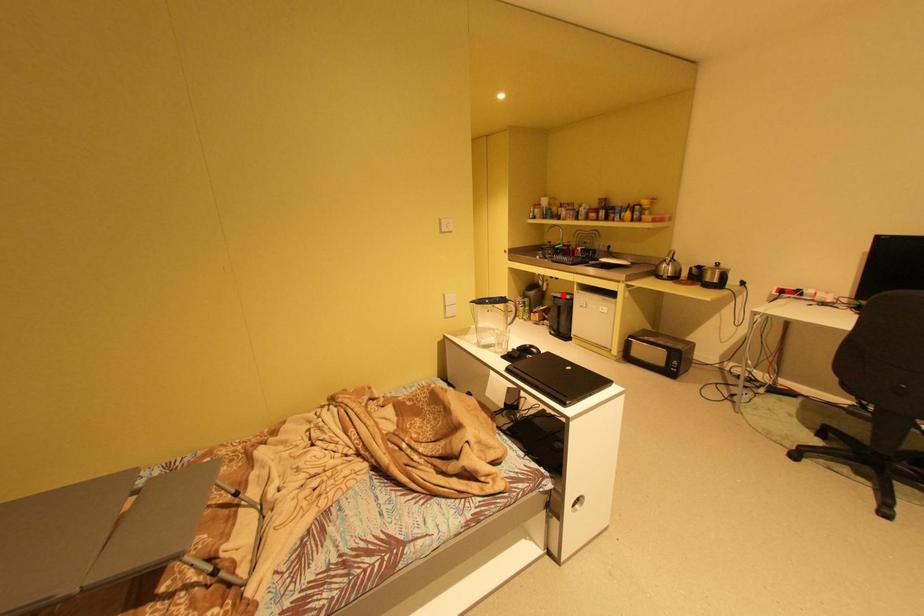
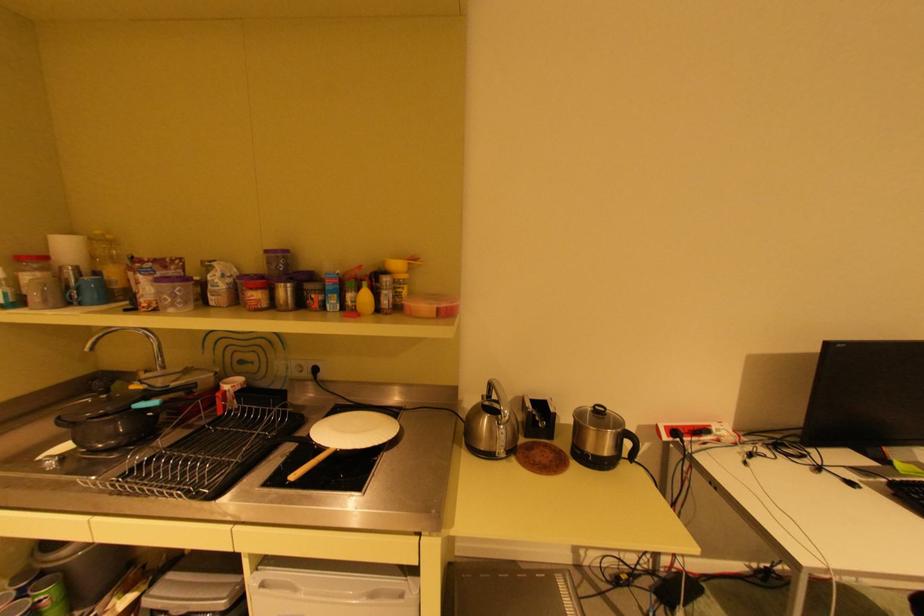
Find the pixel in the second image that matches the highlighted location in the first image.

(168, 609)